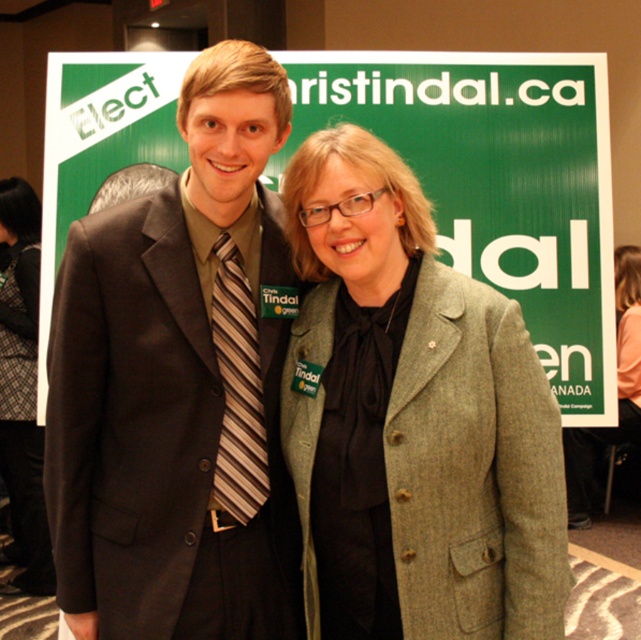
Based on the scene description, where is the green fabric poster at center located in terms of coordinates?

The green fabric poster at center is located at point [495,182].

You are a photographer standing at a specific spot. You want to capture a clear photo of the green fabric poster at center without any blur. The camera you are using has a minimum focus distance of 8 feet. Will you be able to take the photo clearly?

The green fabric poster at center is 7.46 feet away from camera. Since the minimum focus distance is 8 feet, the camera cannot focus clearly at 7.46 feet. Therefore, the photo will be blurry.

You are a photographer setting up for a campaign photo shoot. You need to ensure that the green fabric poster at center and the black lace dress at left are both visible in the frame. Based on their positions, which object should you focus on first to capture both in the shot?

The green fabric poster at center is above the black lace dress at left, so you should focus on the green fabric poster at center first to ensure both are in the frame.